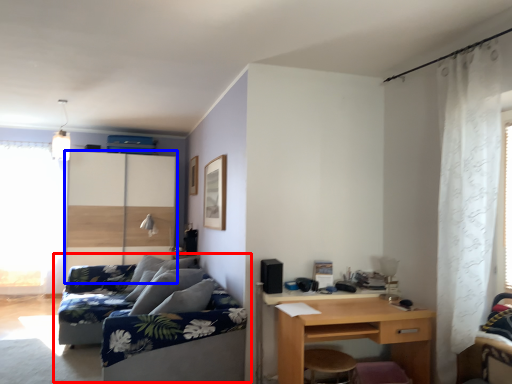
Question: Which point is further to the camera, studio couch (highlighted by a red box) or screen door (highlighted by a blue box)?

Choices:
 (A) studio couch
 (B) screen door

Answer: (B)